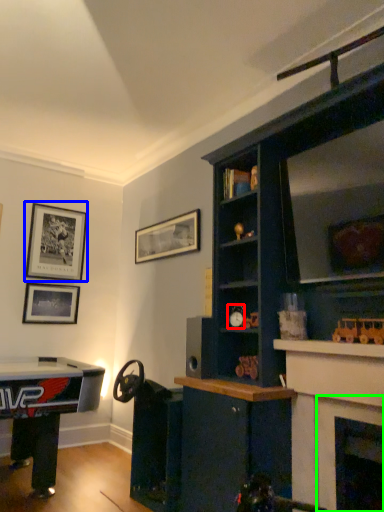
Question: Which object is the closest to the toy (highlighted by a red box)? Choose among these: picture frame (highlighted by a blue box) or fireplace (highlighted by a green box).

Choices:
 (A) picture frame
 (B) fireplace

Answer: (B)